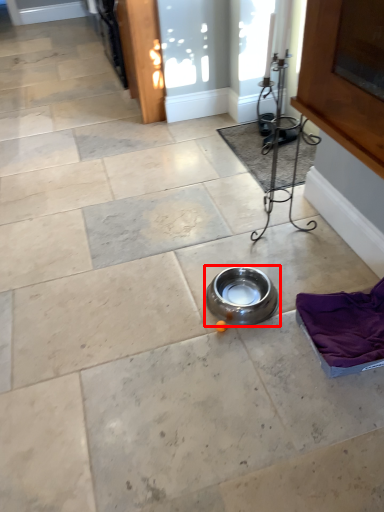
Question: Observing the image, what is the correct spatial positioning of bowl (annotated by the red box) in reference to mat?

Choices:
 (A) left
 (B) right

Answer: (A)